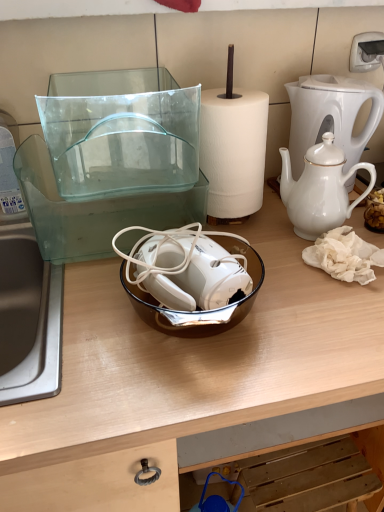
I want to click on free space that is to the left of white porcelain teapot at right, so click(273, 241).